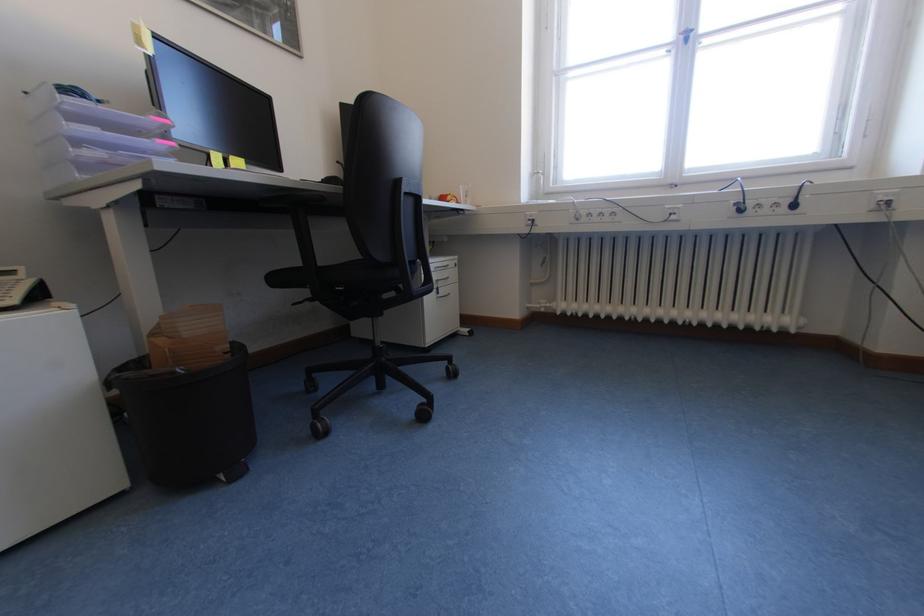
I want to click on chair sitting surface, so click(342, 270).